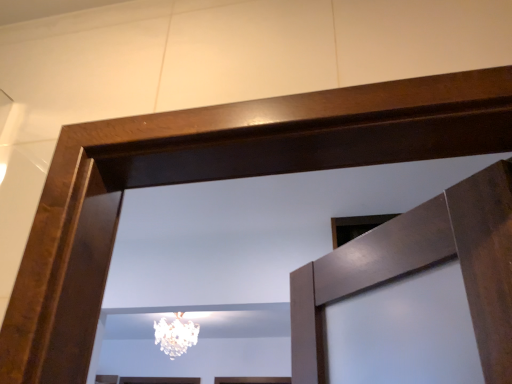
Measure the distance between white glass chandelier at center and camera.

The distance of white glass chandelier at center from camera is 3.21 meters.

The height and width of the screenshot is (384, 512). What do you see at coordinates (175, 335) in the screenshot?
I see `white glass chandelier at center` at bounding box center [175, 335].

Identify the location of white glass chandelier at center. The height and width of the screenshot is (384, 512). (175, 335).

The width and height of the screenshot is (512, 384). I want to click on white glass chandelier at center, so click(x=175, y=335).